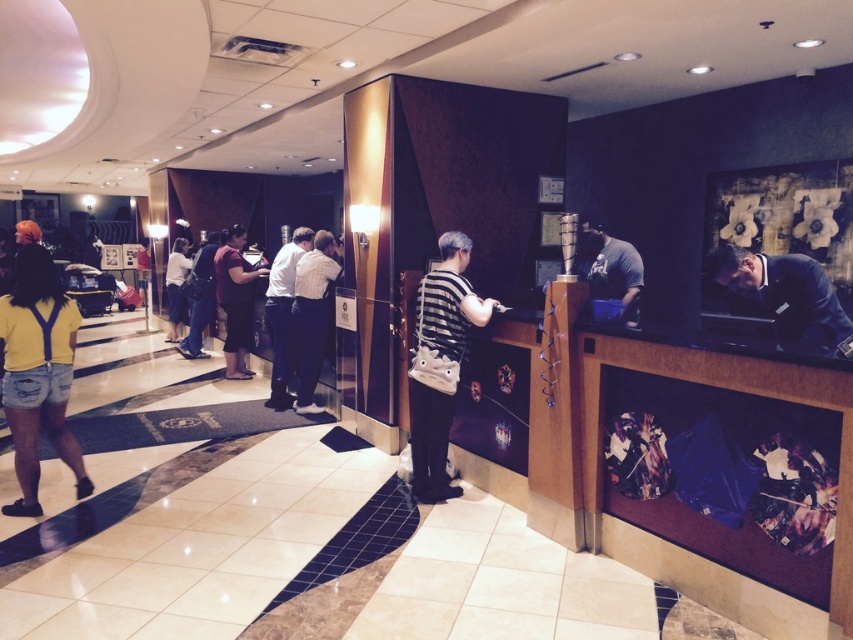
Question: Where is white striped shirt at center located in relation to dark gray shirt at center in the image?

Choices:
 (A) below
 (B) above

Answer: (A)

Question: Which point is farther to the camera?

Choices:
 (A) dark brown leather jacket at center
 (B) white striped shirt at center
 (C) striped fabric shirt at center

Answer: (A)

Question: Which point appears closest to the camera in this image?

Choices:
 (A) (184, 269)
 (B) (190, 285)
 (C) (271, 369)
 (D) (450, 304)

Answer: (D)

Question: Can you confirm if black suit at right is positioned above dark gray shirt at center?

Choices:
 (A) yes
 (B) no

Answer: (B)

Question: Is white striped shirt at center thinner than white shirt at center?

Choices:
 (A) yes
 (B) no

Answer: (B)

Question: Which point is closer to the camera?

Choices:
 (A) yellow denim shorts at lower left
 (B) matte white blouse at center

Answer: (A)